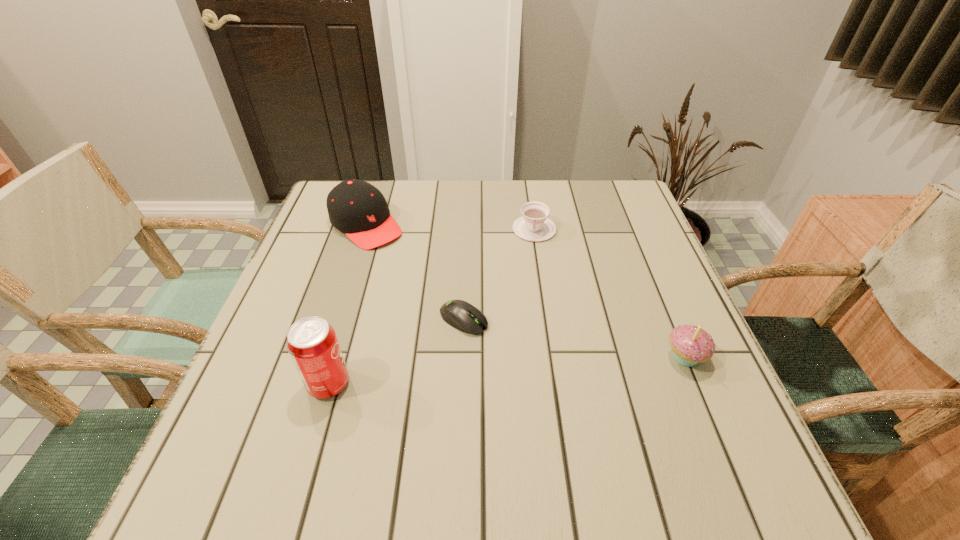
Identify the location of free space at the near left corner of the desktop. (245, 416).

Locate an element on the screen. The height and width of the screenshot is (540, 960). empty space that is in between the cap and the soda is located at coordinates (x=348, y=305).

Where is `vacant space that's between the cap and the second shortest object`? The image size is (960, 540). vacant space that's between the cap and the second shortest object is located at coordinates (450, 227).

Where is `empty location between the computer mouse and the teacup`? empty location between the computer mouse and the teacup is located at coordinates (499, 274).

The width and height of the screenshot is (960, 540). In order to click on vacant area that lies between the cap and the soda in this screenshot , I will do `click(348, 305)`.

Identify the location of free space between the cupcake and the cap. (525, 291).

At what (x,y) coordinates should I click in order to perform the action: click on empty space that is in between the tallest object and the rightmost object. Please return your answer as a coordinate pair (x, y). This screenshot has height=540, width=960. Looking at the image, I should click on (507, 370).

Where is `empty location between the shortest object and the rightmost object`? The width and height of the screenshot is (960, 540). empty location between the shortest object and the rightmost object is located at coordinates (574, 339).

Image resolution: width=960 pixels, height=540 pixels. I want to click on free point between the cap and the teacup, so click(450, 227).

Image resolution: width=960 pixels, height=540 pixels. In order to click on vacant area between the tallest object and the fourth tallest object in this screenshot , I will do `click(431, 307)`.